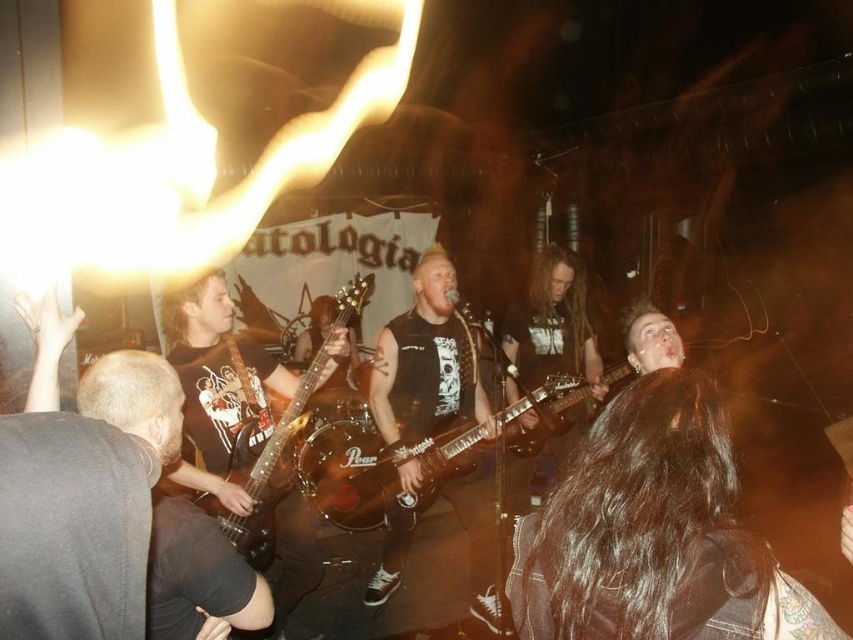
Question: Does shiny black electric guitar at center have a larger size compared to wooden electric guitar at center?

Choices:
 (A) no
 (B) yes

Answer: (B)

Question: Which point is farther from the camera taking this photo?

Choices:
 (A) (354, 305)
 (B) (555, 385)

Answer: (B)

Question: Which of the following is the farthest from the observer?

Choices:
 (A) (323, 452)
 (B) (245, 474)

Answer: (A)

Question: In this image, where is shiny black electric guitar at center located relative to wooden electric guitar at center?

Choices:
 (A) right
 (B) left

Answer: (A)

Question: Can you confirm if shiny black electric guitar at center is positioned below wooden electric guitar at center?

Choices:
 (A) no
 (B) yes

Answer: (B)

Question: Which object appears closest to the camera in this image?

Choices:
 (A) wooden electric guitar at center
 (B) shiny black electric guitar at center

Answer: (A)